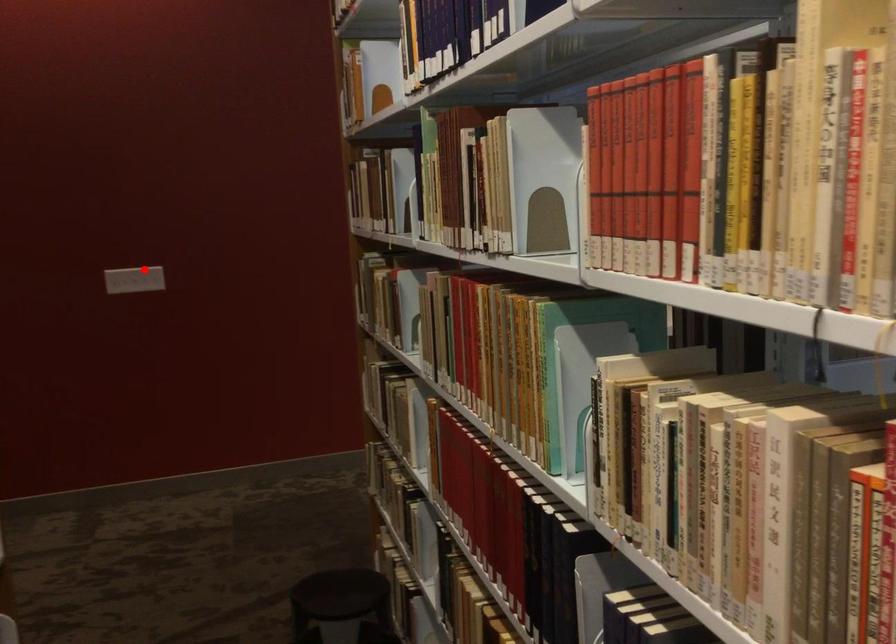
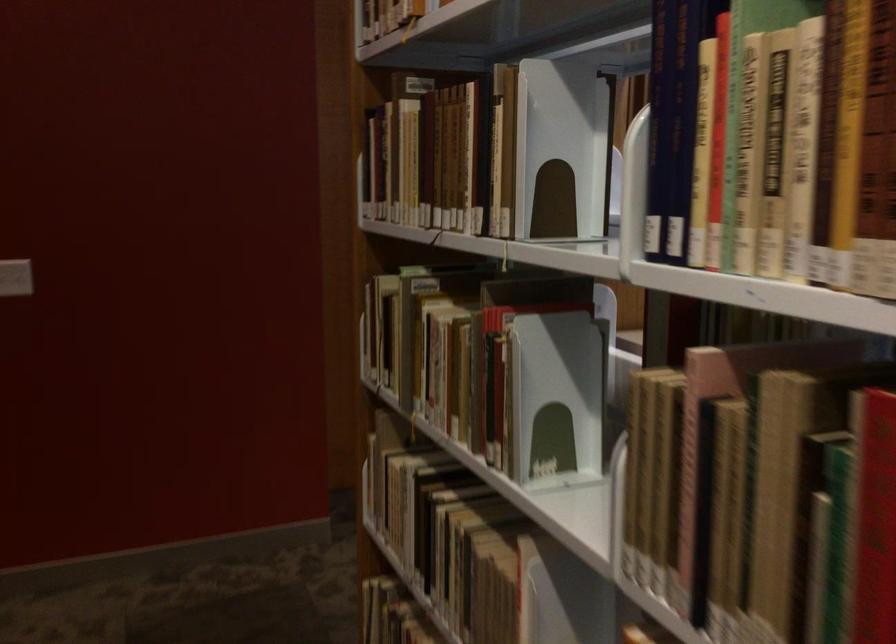
Find the pixel in the second image that matches the highlighted location in the first image.

(15, 277)